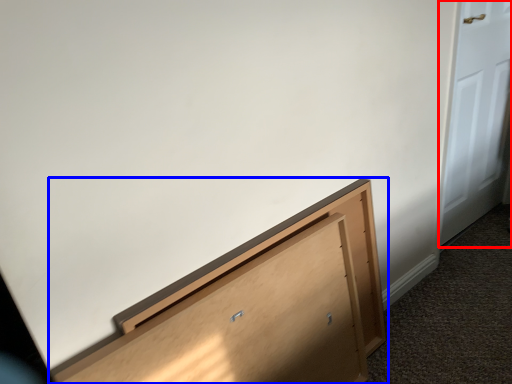
Question: Which of the following is the farthest to the observer, door (highlighted by a red box) or furniture (highlighted by a blue box)?

Choices:
 (A) door
 (B) furniture

Answer: (A)